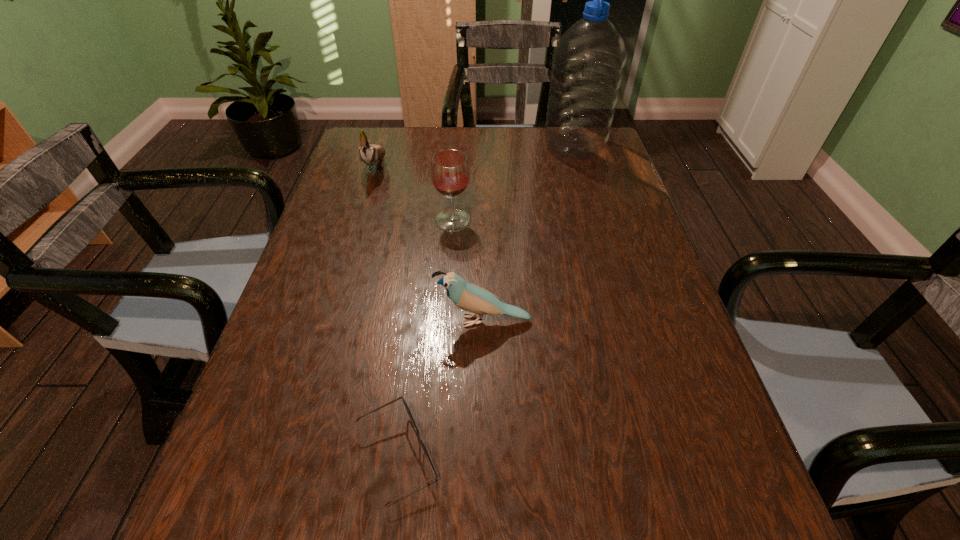
What are the coordinates of `vacant space that satisfies the following two spatial constraints: 1. on the front side of the third nearest object; 2. with the lenses facing outward on the shortest object` in the screenshot? It's located at (437, 456).

The height and width of the screenshot is (540, 960). What are the coordinates of `free location that satisfies the following two spatial constraints: 1. at the face of the third farthest object; 2. on the right side of the leftmost object` in the screenshot? It's located at (360, 220).